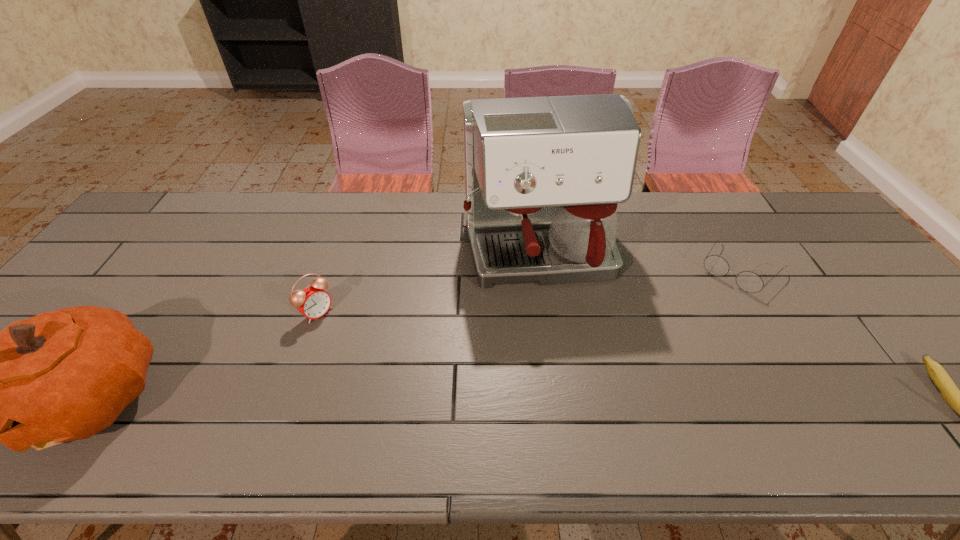
What are the coordinates of `blank space located on the front of the tallest object near the spout` in the screenshot? It's located at (567, 365).

Identify the location of vacant space located 0.050m on the clock face of the alarm clock. 338,332.

At what (x,y) coordinates should I click in order to perform the action: click on free region located 0.170m on the clock face of the alarm clock. Please return your answer as a coordinate pair (x, y). This screenshot has width=960, height=540. Looking at the image, I should click on (368, 359).

Where is `free space located 0.240m on the clock face of the alarm clock`? This screenshot has width=960, height=540. free space located 0.240m on the clock face of the alarm clock is located at coordinates (386, 376).

Where is `object present at the far edge`? The width and height of the screenshot is (960, 540). object present at the far edge is located at coordinates (543, 175).

Identify the location of vacant region at the far edge of the desktop. The image size is (960, 540). (241, 204).

In the image, there is a desktop. At what (x,y) coordinates should I click in order to perform the action: click on free space at the near edge. Please return your answer as a coordinate pair (x, y). Looking at the image, I should click on (887, 407).

Identify the location of vacant space at the left edge of the desktop. This screenshot has width=960, height=540. (115, 285).

Locate an element on the screen. Image resolution: width=960 pixels, height=540 pixels. vacant position at the right edge of the desktop is located at coordinates (887, 373).

In the image, there is a desktop. At what (x,y) coordinates should I click in order to perform the action: click on blank space at the far left corner. Please return your answer as a coordinate pair (x, y). This screenshot has width=960, height=540. Looking at the image, I should click on 152,231.